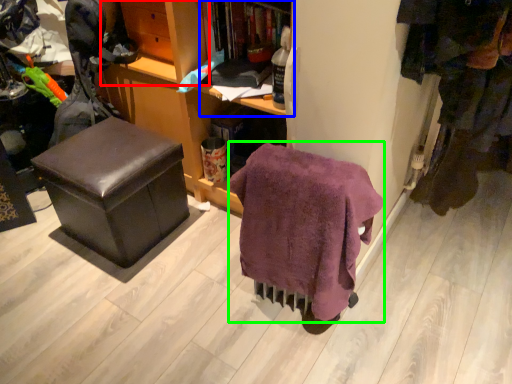
Question: Which object is positioned closest to shelf (highlighted by a red box)? Select from shelf (highlighted by a blue box) and blanket (highlighted by a green box).

Choices:
 (A) shelf
 (B) blanket

Answer: (A)